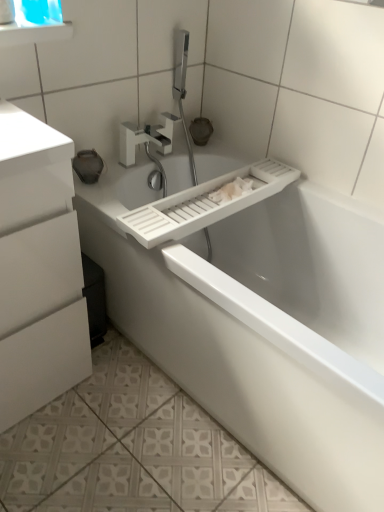
Question: Looking at the image, does white glossy cabinet at left seem bigger or smaller compared to white plastic sink at upper center?

Choices:
 (A) small
 (B) big

Answer: (B)

Question: Is point 1,356 positioned closer to the camera than point 119,218?

Choices:
 (A) closer
 (B) farther

Answer: (A)

Question: Considering the real-world distances, which object is closest to the white plastic sink at upper center?

Choices:
 (A) white glossy cabinet at left
 (B) white plastic bathtub at center
 (C) white matte tap at upper center
 (D) transparent plastic medicine cabinet at upper left
 (E) transparent plastic window screen at upper left

Answer: (C)

Question: Which object is the farthest from the transparent plastic medicine cabinet at upper left?

Choices:
 (A) white plastic sink at upper center
 (B) white plastic bathtub at center
 (C) transparent plastic window screen at upper left
 (D) white glossy cabinet at left
 (E) white matte tap at upper center

Answer: (B)